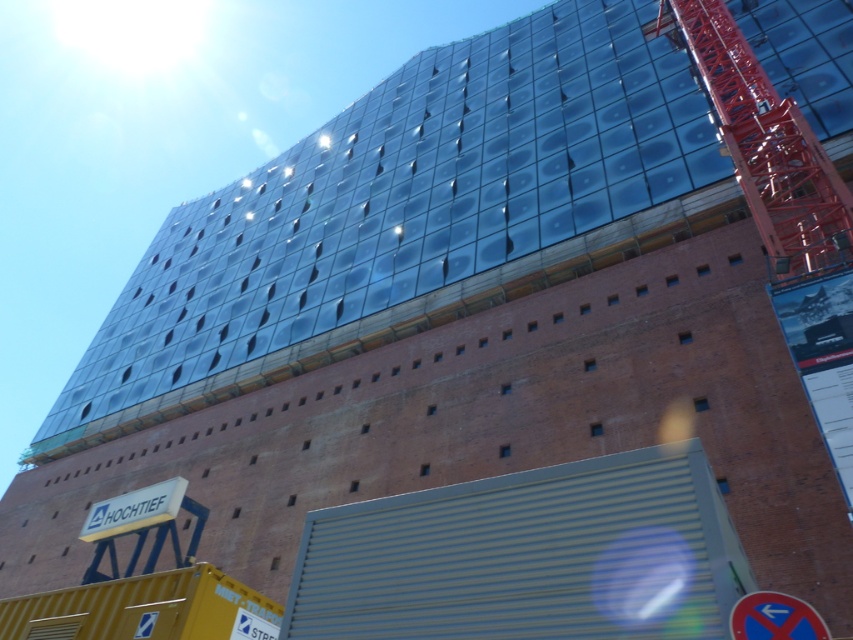
Is point (717, 81) behind point (788, 618)?

That is True.

Is metallic red crane at right positioned in front of blue plastic sign at lower right?

No, it is not.

Between point (694, 38) and point (817, 627), which one is positioned in front?

Point (817, 627) is more forward.

Where is `metallic red crane at right`? metallic red crane at right is located at coordinates 769,148.